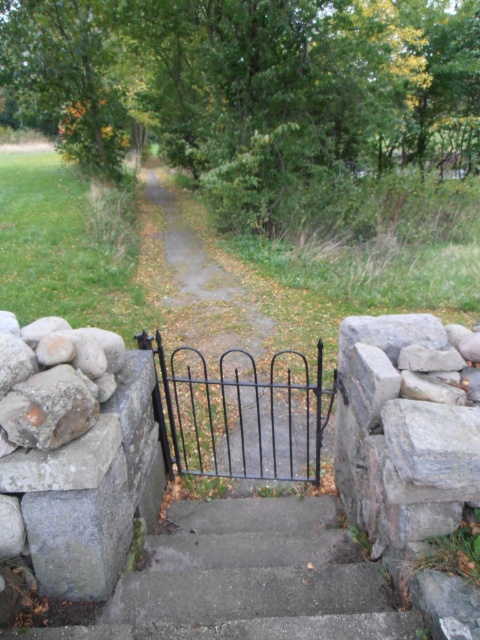
Is black metal gate at center taller than black wrought iron gate at center?

Yes, black metal gate at center is taller than black wrought iron gate at center.

Consider the image. Is black metal gate at center positioned at the back of black wrought iron gate at center?

Yes, it is.

Where is `black metal gate at center`? The width and height of the screenshot is (480, 640). black metal gate at center is located at coordinates (240, 413).

Which is in front, point (437, 424) or point (319, 371)?

Point (437, 424) is in front.

From the picture: Does gray rough stone at right have a greater width compared to black metal gate at center?

No.

Locate an element on the screen. This screenshot has height=640, width=480. gray rough stone at right is located at coordinates (403, 429).

Between concrete stairs at center and black wrought iron gate at center, which one is positioned lower?

concrete stairs at center is lower down.

What do you see at coordinates (256, 577) in the screenshot? I see `concrete stairs at center` at bounding box center [256, 577].

Identify the location of concrete stairs at center. (256, 577).